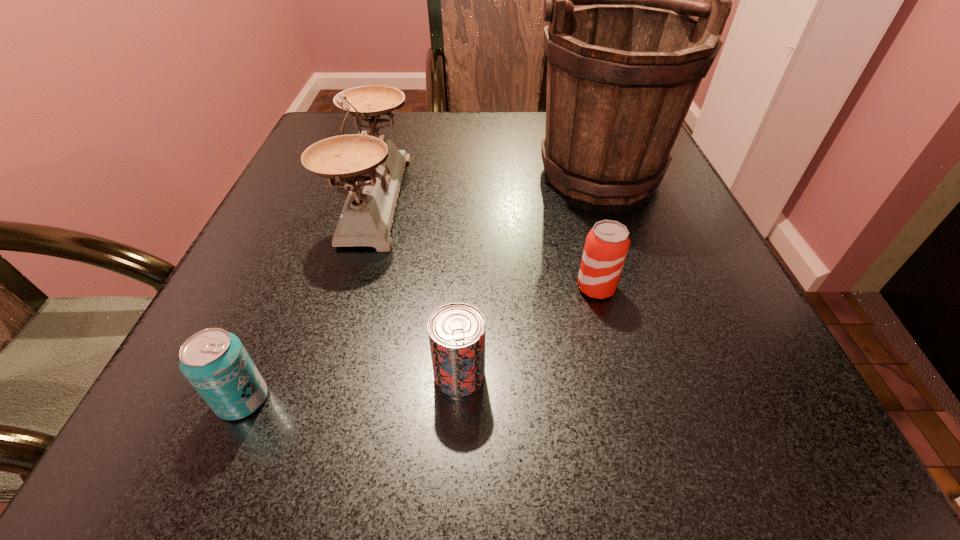
Locate an element on the screen. The height and width of the screenshot is (540, 960). the tallest object is located at coordinates (622, 73).

You are a GUI agent. You are given a task and a screenshot of the screen. Output one action in this format:
    pyautogui.click(x=<x>, y=<y>)
    Task: Click on the scale
    This screenshot has height=540, width=960.
    Given the screenshot: What is the action you would take?
    pyautogui.click(x=372, y=168)

Image resolution: width=960 pixels, height=540 pixels. What are the coordinates of `the farthest beer can` in the screenshot? It's located at (606, 247).

Image resolution: width=960 pixels, height=540 pixels. I want to click on the rightmost beer can, so click(606, 247).

You are a GUI agent. You are given a task and a screenshot of the screen. Output one action in this format:
    pyautogui.click(x=<x>, y=<y>)
    Task: Click on the leftmost beer can
    
    Given the screenshot: What is the action you would take?
    pyautogui.click(x=214, y=361)

At what (x,y) coordinates should I click in order to perform the action: click on the second beer can from right to left. Please return your answer as a coordinate pair (x, y). The height and width of the screenshot is (540, 960). Looking at the image, I should click on (456, 331).

I want to click on vacant region located 0.090m on the handle side of the tallest object, so click(x=490, y=156).

Image resolution: width=960 pixels, height=540 pixels. I want to click on vacant point located on the handle side of the tallest object, so click(x=498, y=156).

Locate an element on the screen. The height and width of the screenshot is (540, 960). free location located on the handle side of the tallest object is located at coordinates (490, 156).

The image size is (960, 540). Find the location of `blank area located on the front-facing side of the second tallest object`. blank area located on the front-facing side of the second tallest object is located at coordinates (516, 198).